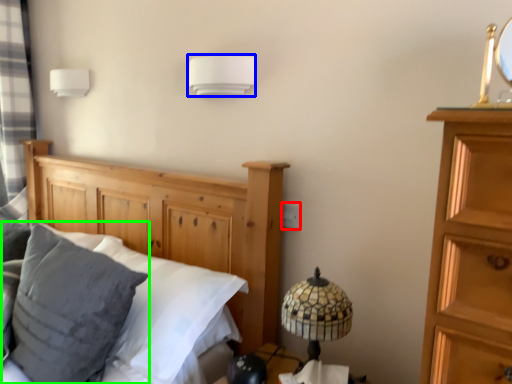
Question: Based on their relative distances, which object is farther from electric outlet (highlighted by a red box)? Choose from lamp (highlighted by a blue box) and pillow (highlighted by a green box).

Choices:
 (A) lamp
 (B) pillow

Answer: (B)